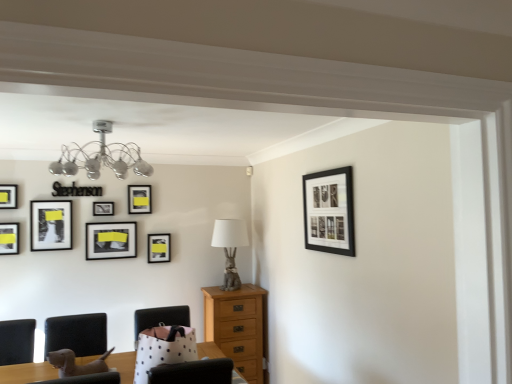
Question: Is point (94, 203) positioned closer to the camera than point (179, 322)?

Choices:
 (A) closer
 (B) farther

Answer: (B)

Question: From a real-world perspective, relative to white polka dot fabric armchair at center, acting as the 2th armchair starting from the left, is matte black picture frame at upper left, the 6th picture frame positioned from the front, vertically above or below?

Choices:
 (A) above
 (B) below

Answer: (A)

Question: Which object is positioned farthest from the matte black picture frame at upper left, the 7th picture frame positioned from the back?

Choices:
 (A) gray fabric lamp at center
 (B) chrome metallic chandelier at upper left
 (C) black matte picture frame at upper right, marked as the first picture frame in a right-to-left arrangement
 (D) matte black picture frame at left, which ranks as the third picture frame in left-to-right order
 (E) light brown leather armchair at lower left, which is the 2th armchair in right-to-left order

Answer: (C)

Question: Which object is the farthest from the light brown wooden chest of drawers at center?

Choices:
 (A) gray fabric lamp at center
 (B) white polka dot fabric armchair at center, which is the 1th armchair in right-to-left order
 (C) light brown leather armchair at lower left, which is the 2th armchair in right-to-left order
 (D) matte black picture frame at upper left, arranged as the fourth picture frame when viewed from the left
 (E) matte black picture frame at left, the 4th picture frame in the front-to-back sequence

Answer: (E)